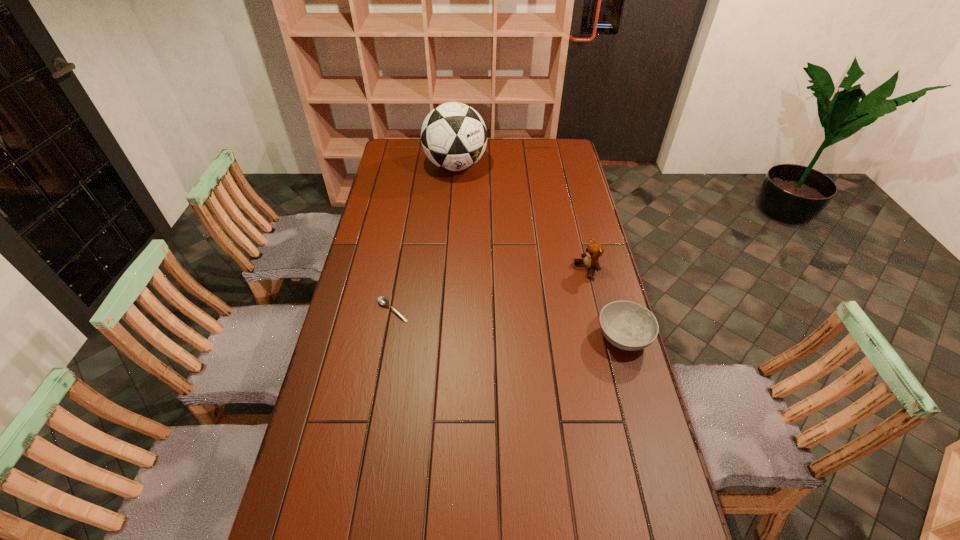
This screenshot has height=540, width=960. Find the location of `free spot on the desktop that is between the soupspoon and the bowl and is positioned on the surface of the farthest object where the brand logo is visible`. free spot on the desktop that is between the soupspoon and the bowl and is positioned on the surface of the farthest object where the brand logo is visible is located at coordinates (489, 321).

Find the location of a particular element. free space on the desktop that is between the shortest object and the third tallest object and is positioned on the front-facing side of the teddy bear is located at coordinates (474, 319).